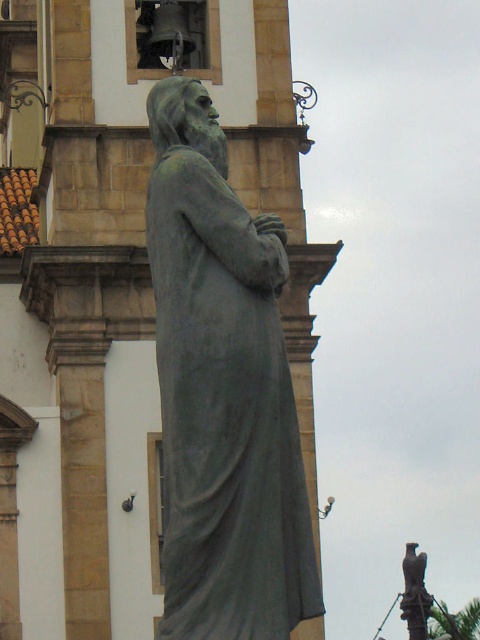
You are standing at the camera position and want to take a photo of the green patina statue at center. If your camera has a maximum focus range of 30 meters, will you be able to focus on the statue?

The green patina statue at center and camera are 35.00 meters apart from each other. Since the maximum focus range is 30 meters, the camera cannot focus on the statue.

You are a tour guide leading a group of visitors. You want to inform them about the distance between the green patina statue at center and the bronze statue at lower right. What should you say?

The green patina statue at center is 39.75 meters away from the bronze statue at lower right.